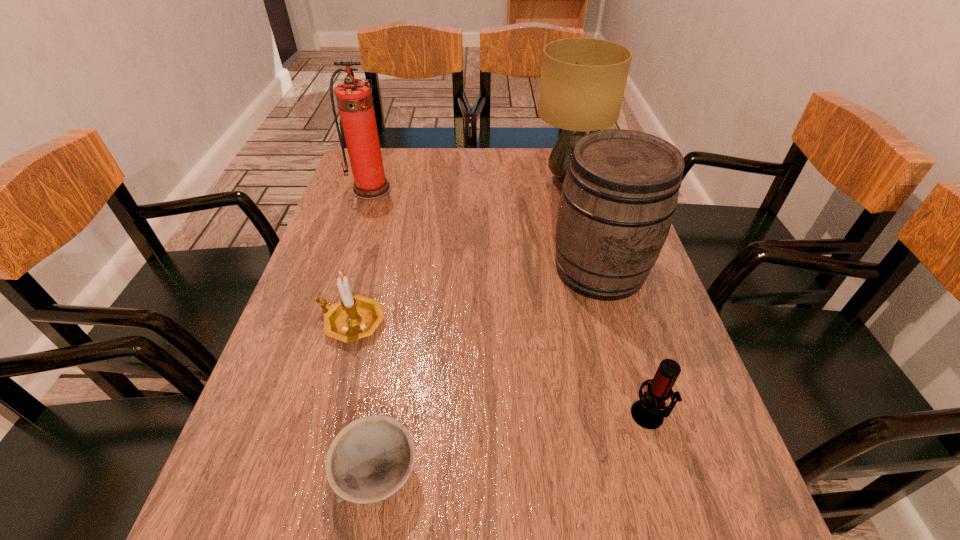
The image size is (960, 540). I want to click on empty location between the bowl and the microphone, so click(x=514, y=444).

You are a GUI agent. You are given a task and a screenshot of the screen. Output one action in this format:
    pyautogui.click(x=<x>, y=<y>)
    Task: Click on the vacant area between the candle holder and the second nearest object
    The image size is (960, 540).
    Given the screenshot: What is the action you would take?
    pyautogui.click(x=501, y=369)

Where is `free space between the candle holder and the lampshade`? free space between the candle holder and the lampshade is located at coordinates (460, 251).

At what (x,y) coordinates should I click in order to perform the action: click on empty space between the lampshade and the shortest object. Please return your answer as a coordinate pair (x, y). This screenshot has width=960, height=540. Looking at the image, I should click on (472, 327).

Identify the location of vacant region between the lampshade and the nearest object. (472, 327).

You are a GUI agent. You are given a task and a screenshot of the screen. Output one action in this format:
    pyautogui.click(x=<x>, y=<y>)
    Task: Click on the empty space that is in between the fifth farthest object and the candle holder
    
    Given the screenshot: What is the action you would take?
    pyautogui.click(x=501, y=369)

Identify the location of the fourth closest object to the fire extinguisher. (370, 459).

Select which object is the second closest to the second nearest object. Please provide its 2D coordinates. Your answer should be formatted as a tuple, i.e. [(x, y)], where the tuple contains the x and y coordinates of a point satisfying the conditions above.

[(370, 459)]

This screenshot has width=960, height=540. I want to click on vacant region that satisfies the following two spatial constraints: 1. on the back side of the shortest object; 2. on the right side of the microphone, so click(387, 415).

The image size is (960, 540). In order to click on free space that satisfies the following two spatial constraints: 1. on the front side of the shortest object; 2. on the right side of the candle holder in this screenshot , I will do `click(310, 474)`.